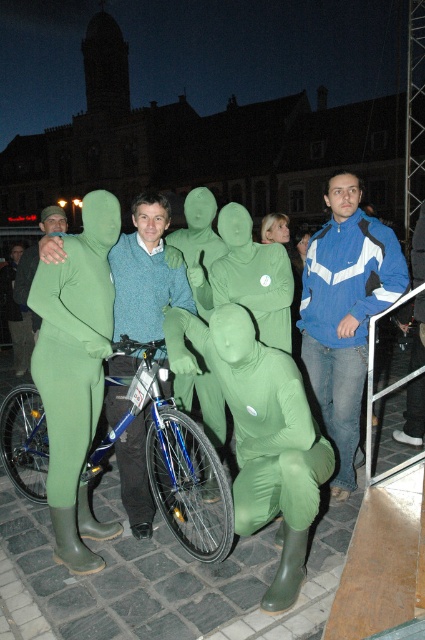
Is green matte suit at center shorter than blue metallic bicycle at center?

Indeed, green matte suit at center has a lesser height compared to blue metallic bicycle at center.

Between green matte suit at center and blue metallic bicycle at center, which one is positioned higher?

green matte suit at center

Does point (238, 310) come behind point (42, 490)?

No, (238, 310) is in front of (42, 490).

You are a GUI agent. You are given a task and a screenshot of the screen. Output one action in this format:
    pyautogui.click(x=<x>, y=<y>)
    Task: Click on the green matte suit at center
    Image resolution: width=425 pixels, height=640 pixels.
    Given the screenshot: What is the action you would take?
    pyautogui.click(x=260, y=417)

Consider the image. Can you confirm if blue/white jacket at right is positioned to the right of knitted sweater at center?

Correct, you'll find blue/white jacket at right to the right of knitted sweater at center.

In the scene shown: Is blue/white jacket at right bigger than knitted sweater at center?

Indeed, blue/white jacket at right has a larger size compared to knitted sweater at center.

Does point (401, 250) come behind point (144, 248)?

Yes, it is.

The image size is (425, 640). I want to click on blue/white jacket at right, so click(x=345, y=314).

Does green matte suit at center appear over knitted sweater at center?

Incorrect, green matte suit at center is not positioned above knitted sweater at center.

Is green matte suit at center thinner than knitted sweater at center?

No, green matte suit at center is not thinner than knitted sweater at center.

This screenshot has width=425, height=640. I want to click on green matte suit at center, so click(260, 417).